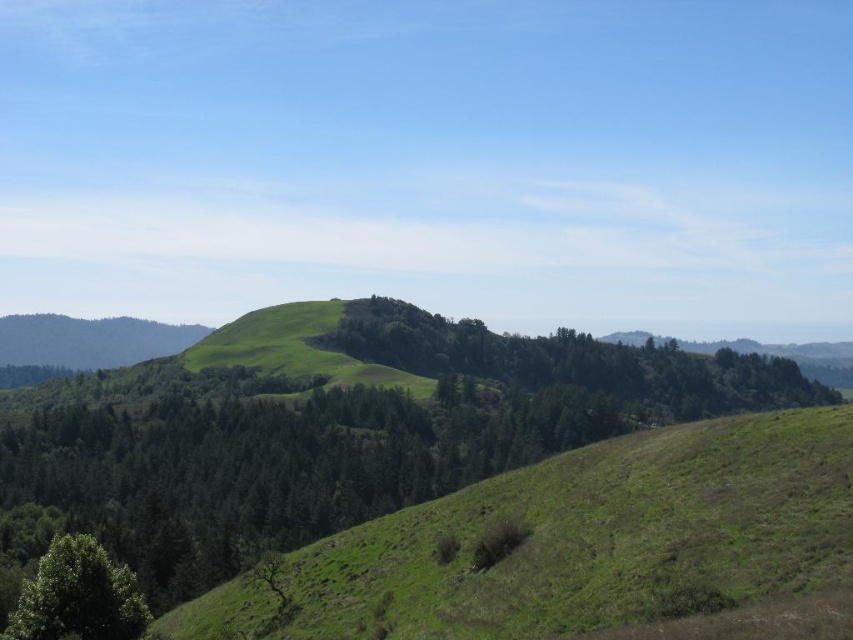
Does green leafy tree at center appear under green leafy tree at lower left?

No.

Locate an element on the screen. green leafy tree at center is located at coordinates (440, 483).

You are a GUI agent. You are given a task and a screenshot of the screen. Output one action in this format:
    pyautogui.click(x=<x>, y=<y>)
    Task: Click on the green leafy tree at center
    This screenshot has width=853, height=640.
    Given the screenshot: What is the action you would take?
    pyautogui.click(x=440, y=483)